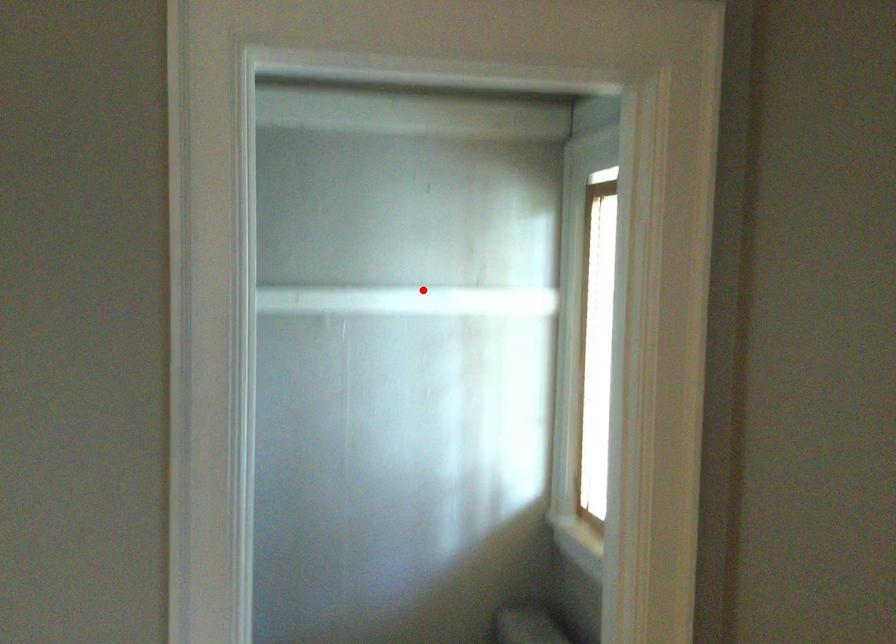
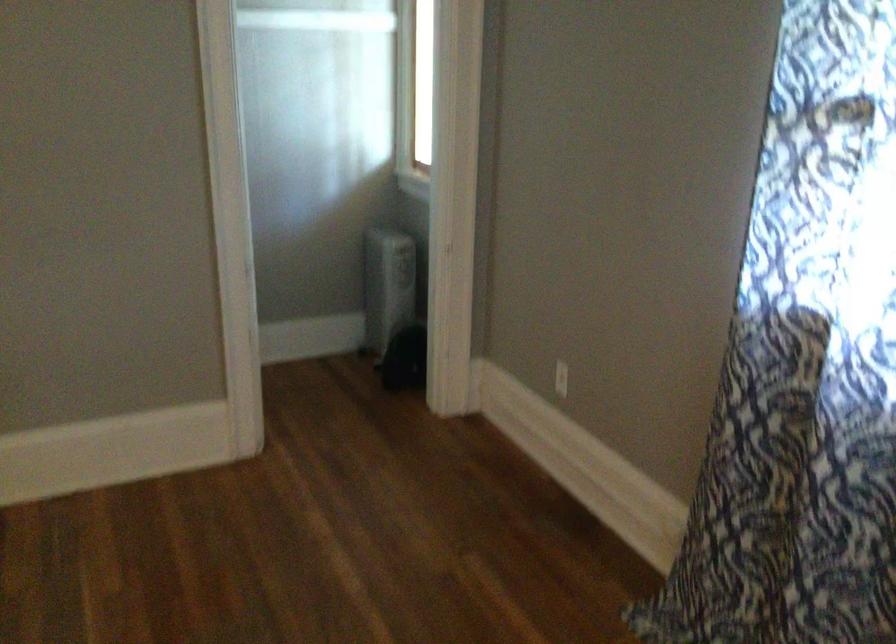
Find the pixel in the second image that matches the highlighted location in the first image.

(313, 13)